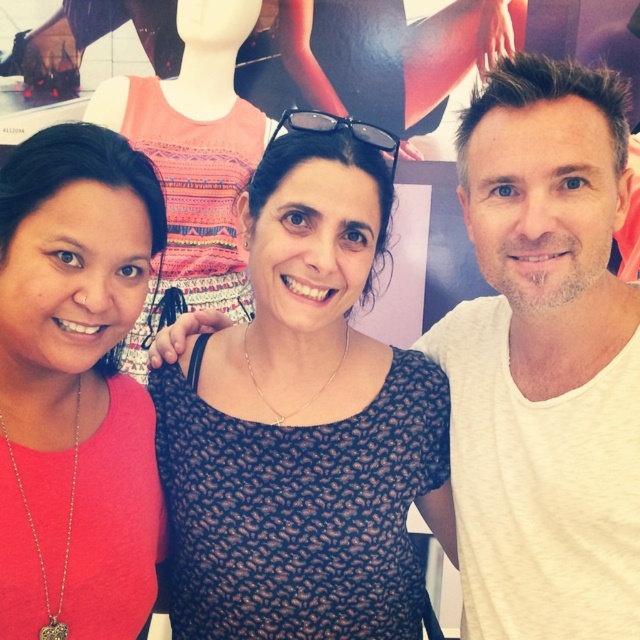
Question: Among these points, which one is farthest from the camera?

Choices:
 (A) click(x=294, y=442)
 (B) click(x=362, y=124)
 (C) click(x=500, y=422)
 (D) click(x=83, y=125)

Answer: (A)

Question: Is black dotted dress at center positioned before white cotton t-shirt at right?

Choices:
 (A) no
 (B) yes

Answer: (A)

Question: Is pink matte shirt at left in front of black plastic sunglasses at center?

Choices:
 (A) no
 (B) yes

Answer: (B)

Question: Estimate the real-world distances between objects in this image. Which object is closer to the pink matte shirt at left?

Choices:
 (A) black dotted dress at center
 (B) white cotton t-shirt at right

Answer: (A)

Question: Which of the following is the farthest from the observer?

Choices:
 (A) click(385, 132)
 (B) click(582, 168)
 (C) click(6, 330)

Answer: (A)

Question: Does pink matte shirt at left lie in front of black plastic sunglasses at center?

Choices:
 (A) no
 (B) yes

Answer: (B)